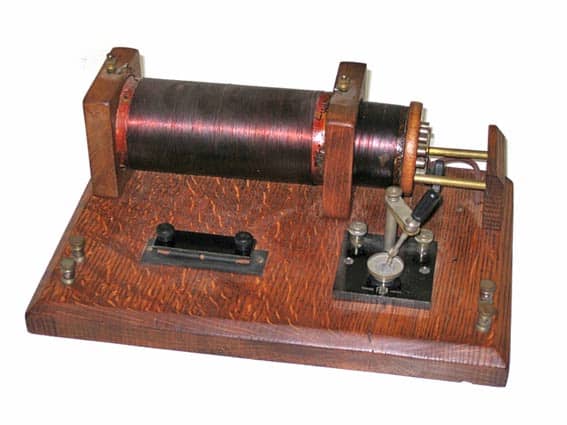
The width and height of the screenshot is (567, 425). I want to click on wooden base, so click(x=287, y=217).